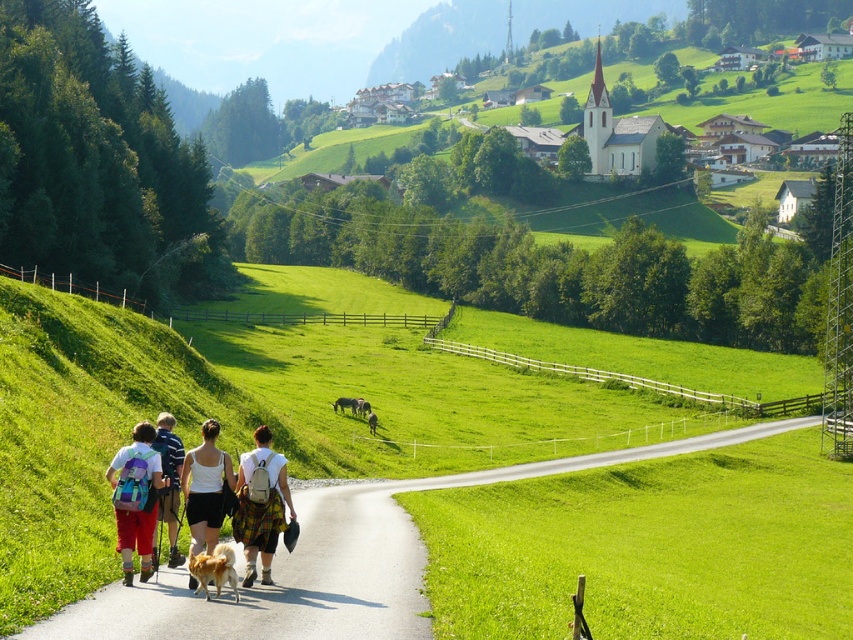
Question: Does white cotton tank top at center have a larger size compared to matte blue backpack at center?

Choices:
 (A) yes
 (B) no

Answer: (A)

Question: Can you confirm if white fabric skirt at center is bigger than white cotton tank top at center?

Choices:
 (A) no
 (B) yes

Answer: (A)

Question: Which of the following is the farthest from the observer?

Choices:
 (A) smooth asphalt road at center
 (B) white cotton tank top at center

Answer: (B)

Question: Can you confirm if white cotton tank top at center is smaller than matte blue backpack at center?

Choices:
 (A) yes
 (B) no

Answer: (B)

Question: Which point is farther from the camera taking this photo?

Choices:
 (A) (370, 515)
 (B) (242, 460)

Answer: (A)

Question: Which object appears closest to the camera in this image?

Choices:
 (A) matte purple backpack at center
 (B) matte blue backpack at center
 (C) smooth asphalt road at center
 (D) white fabric skirt at center

Answer: (C)